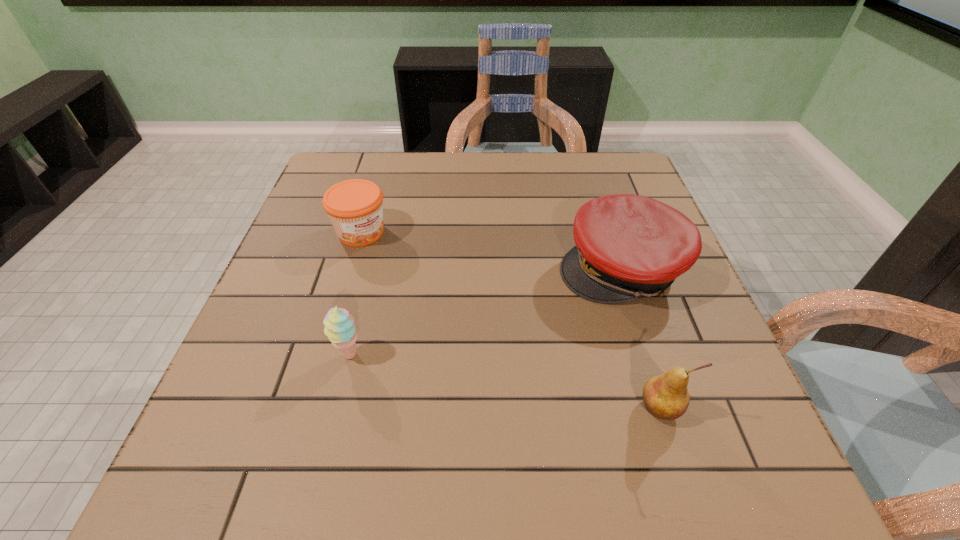
You are a GUI agent. You are given a task and a screenshot of the screen. Output one action in this format:
    pyautogui.click(x=<x>, y=<y>)
    Task: Click on the free region at the near left corner of the desktop
    This screenshot has height=540, width=960.
    Given the screenshot: What is the action you would take?
    (x=249, y=402)

Where is `free space at the far right corner`? The height and width of the screenshot is (540, 960). free space at the far right corner is located at coordinates (631, 154).

Identify the location of blank space at the near right corner. The image size is (960, 540). (730, 426).

I want to click on empty space that is in between the jam and the third farthest object, so click(355, 293).

Locate an element on the screen. The width and height of the screenshot is (960, 540). vacant area that lies between the third farthest object and the cap is located at coordinates (485, 312).

Where is `empty space between the jam and the cap`? This screenshot has width=960, height=540. empty space between the jam and the cap is located at coordinates (491, 251).

The image size is (960, 540). In order to click on free space between the third farthest object and the nearest object in this screenshot , I will do `click(505, 381)`.

The width and height of the screenshot is (960, 540). I want to click on vacant region between the second nearest object and the pear, so click(x=505, y=381).

Locate an element on the screen. Image resolution: width=960 pixels, height=540 pixels. vacant area between the cap and the nearest object is located at coordinates (640, 339).

Identify the location of free space between the jam and the sherbert. (355, 293).